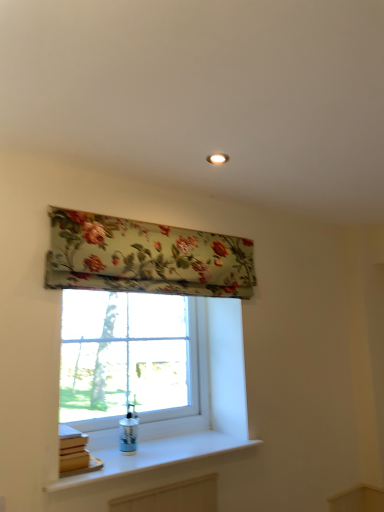
Question: Is clear glass window at center looking in the opposite direction of white smooth window sill at lower center?

Choices:
 (A) no
 (B) yes

Answer: (A)

Question: From a real-world perspective, is clear glass window at center located higher than white smooth window sill at lower center?

Choices:
 (A) no
 (B) yes

Answer: (B)

Question: Is clear glass window at center far from white smooth window sill at lower center?

Choices:
 (A) yes
 (B) no

Answer: (B)

Question: Considering the relative sizes of clear glass window at center and white smooth window sill at lower center in the image provided, is clear glass window at center bigger than white smooth window sill at lower center?

Choices:
 (A) no
 (B) yes

Answer: (B)

Question: Is clear glass window at center thinner than white smooth window sill at lower center?

Choices:
 (A) no
 (B) yes

Answer: (B)

Question: Is clear glass window at center not inside white smooth window sill at lower center?

Choices:
 (A) yes
 (B) no

Answer: (A)

Question: Considering the relative sizes of white smooth window sill at lower center and floral fabric window blind at upper center in the image provided, is white smooth window sill at lower center thinner than floral fabric window blind at upper center?

Choices:
 (A) no
 (B) yes

Answer: (A)

Question: Does white smooth window sill at lower center contain floral fabric window blind at upper center?

Choices:
 (A) no
 (B) yes

Answer: (A)

Question: From the image's perspective, is white smooth window sill at lower center below floral fabric window blind at upper center?

Choices:
 (A) yes
 (B) no

Answer: (A)

Question: Does white smooth window sill at lower center come in front of floral fabric window blind at upper center?

Choices:
 (A) yes
 (B) no

Answer: (A)

Question: Would you consider white smooth window sill at lower center to be distant from floral fabric window blind at upper center?

Choices:
 (A) no
 (B) yes

Answer: (A)

Question: Is white smooth window sill at lower center aimed at floral fabric window blind at upper center?

Choices:
 (A) no
 (B) yes

Answer: (A)

Question: From the image's perspective, is floral fabric window blind at upper center under clear glass window at center?

Choices:
 (A) no
 (B) yes

Answer: (A)